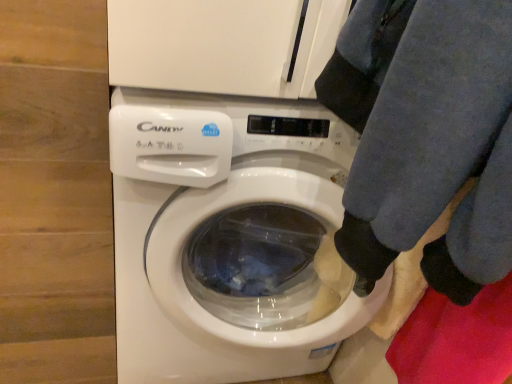
Question: Is blue fleece pants at lower right in front of or behind white glossy washing machine at center in the image?

Choices:
 (A) behind
 (B) front

Answer: (B)

Question: In terms of height, does blue fleece pants at lower right look taller or shorter compared to white glossy washing machine at center?

Choices:
 (A) short
 (B) tall

Answer: (A)

Question: Would you say blue fleece pants at lower right is inside or outside white glossy washing machine at center?

Choices:
 (A) inside
 (B) outside

Answer: (B)

Question: Considering the positions of white glossy washing machine at center and blue fleece pants at lower right in the image, is white glossy washing machine at center bigger or smaller than blue fleece pants at lower right?

Choices:
 (A) big
 (B) small

Answer: (A)

Question: Choose the correct answer: Is white glossy washing machine at center inside blue fleece pants at lower right or outside it?

Choices:
 (A) outside
 (B) inside

Answer: (A)

Question: From the image's perspective, relative to blue fleece pants at lower right, is white glossy washing machine at center above or below?

Choices:
 (A) below
 (B) above

Answer: (A)

Question: From their relative heights in the image, would you say white glossy washing machine at center is taller or shorter than blue fleece pants at lower right?

Choices:
 (A) short
 (B) tall

Answer: (B)